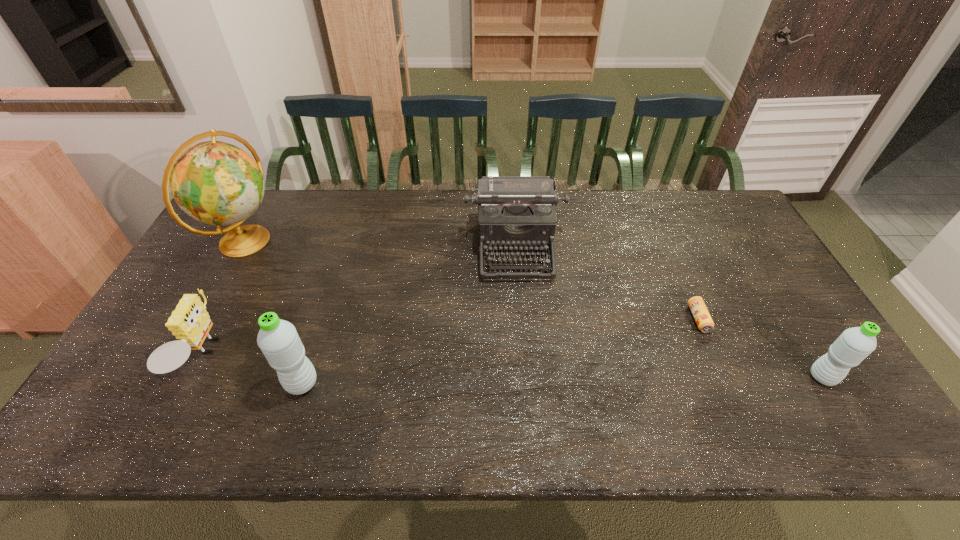
The height and width of the screenshot is (540, 960). In order to click on the left water bottle in this screenshot , I will do `click(278, 339)`.

Locate an element on the screen. The width and height of the screenshot is (960, 540). the taller water bottle is located at coordinates (278, 339).

Locate an element on the screen. the shorter water bottle is located at coordinates (854, 344).

Where is `the right water bottle`? The width and height of the screenshot is (960, 540). the right water bottle is located at coordinates (854, 344).

The height and width of the screenshot is (540, 960). I want to click on the tallest object, so click(x=217, y=183).

The width and height of the screenshot is (960, 540). Identify the location of the shortest object. (696, 304).

Identify the location of beer can. The width and height of the screenshot is (960, 540). (696, 304).

At what (x,y) coordinates should I click in order to perform the action: click on typewriter. Please return your answer as a coordinate pair (x, y). Looking at the image, I should click on (514, 212).

Identify the location of the fifth tallest object. (190, 322).

You are a GUI agent. You are given a task and a screenshot of the screen. Output one action in this format:
    pyautogui.click(x=<x>, y=<y>)
    Task: Click on the vacant area situated 0.320m on the right of the taller water bottle
    This screenshot has height=540, width=960.
    Given the screenshot: What is the action you would take?
    click(x=450, y=383)